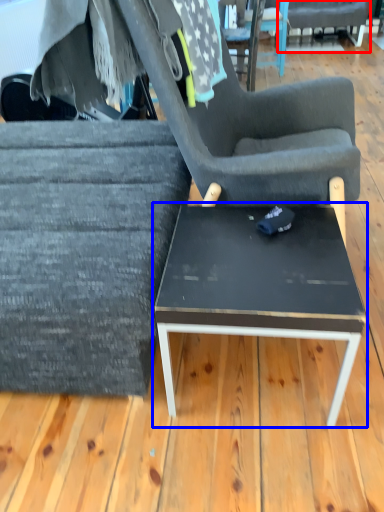
Question: Which point is closer to the camera, chair (highlighted by a red box) or coffee table (highlighted by a blue box)?

Choices:
 (A) chair
 (B) coffee table

Answer: (B)